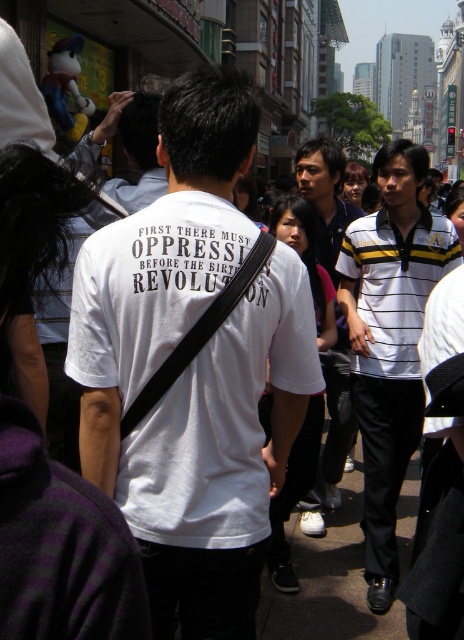
Question: Does white matte t-shirt at center appear on the left side of striped polo shirt at center?

Choices:
 (A) no
 (B) yes

Answer: (B)

Question: Which object is farther from the camera taking this photo?

Choices:
 (A) white striped polo shirt at center
 (B) white matte t-shirt at center
 (C) striped polo shirt at center

Answer: (C)

Question: Is white striped polo shirt at center positioned in front of striped polo shirt at center?

Choices:
 (A) yes
 (B) no

Answer: (A)

Question: Can you confirm if white matte t-shirt at center is wider than white striped polo shirt at center?

Choices:
 (A) no
 (B) yes

Answer: (B)

Question: Which object appears closest to the camera in this image?

Choices:
 (A) striped polo shirt at center
 (B) white striped polo shirt at center

Answer: (B)

Question: Which of the following is the farthest from the observer?

Choices:
 (A) (94, 296)
 (B) (418, 416)
 (C) (352, 440)

Answer: (C)